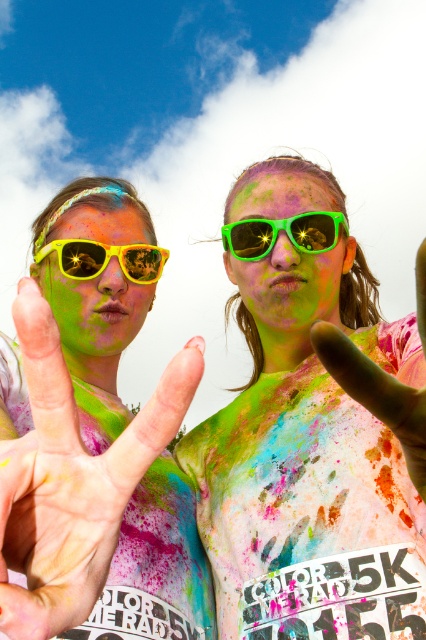
Between point (305, 321) and point (241, 243), which one is positioned behind?

Point (241, 243)

Is point (340, 232) less distant than point (238, 234)?

That is True.

Is point (311, 262) in front of point (322, 227)?

Yes, point (311, 262) is in front of point (322, 227).

Identify the location of green matte sunglasses at center. (291, 284).

Locate an element on the screen. matte yellow sunglasses at left is located at coordinates (94, 438).

Is matte yellow sunglasses at left shorter than green matte hand at center?

Incorrect, matte yellow sunglasses at left's height does not fall short of green matte hand at center's.

The height and width of the screenshot is (640, 426). Describe the element at coordinates (94, 438) in the screenshot. I see `matte yellow sunglasses at left` at that location.

What are the coordinates of `matte yellow sunglasses at left` in the screenshot? It's located at (94, 438).

How distant is matte yellow sunglasses at left from green matte sunglasses at center?

A distance of 16.86 inches exists between matte yellow sunglasses at left and green matte sunglasses at center.

Is matte yellow sunglasses at left taller than green matte sunglasses at center?

Yes, matte yellow sunglasses at left is taller than green matte sunglasses at center.

Who is more distant from viewer, (95, 442) or (267, 282)?

Point (267, 282)

At what (x,y) coordinates should I click in order to perform the action: click on matte yellow sunglasses at left. Please return your answer as a coordinate pair (x, y). The image size is (426, 640). Looking at the image, I should click on (94, 438).